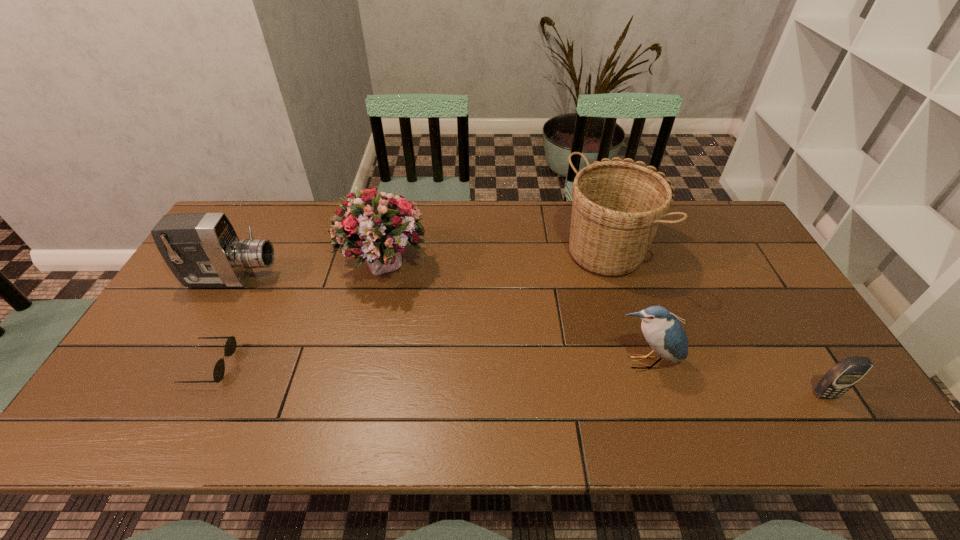
You are a GUI agent. You are given a task and a screenshot of the screen. Output one action in this format:
    pyautogui.click(x=<x>, y=<y>)
    Task: Click on the free space between the sunglasses and the basket
    The height and width of the screenshot is (540, 960).
    Given the screenshot: What is the action you would take?
    pyautogui.click(x=413, y=305)

Locate an element on the screen. Image resolution: width=960 pixels, height=540 pixels. free space that is in between the second shortest object and the sunglasses is located at coordinates (517, 380).

Point out which object is positioned as the fourth nearest to the fourth object from right to left. Please provide its 2D coordinates. Your answer should be formatted as a tuple, i.e. [(x, y)], where the tuple contains the x and y coordinates of a point satisfying the conditions above.

[(664, 333)]

Identify the location of object that is the fifth closest to the camcorder. (848, 371).

This screenshot has height=540, width=960. I want to click on vacant region that satisfies the following two spatial constraints: 1. at the tip of the bird's beak; 2. on the front-facing side of the sunglasses, so click(x=645, y=365).

Identify the location of vacant area that satisfies the following two spatial constraints: 1. on the front side of the fourth object from right to left; 2. at the front of the camcorder, highlighting the lens. The width and height of the screenshot is (960, 540). (382, 279).

At what (x,y) coordinates should I click in order to perform the action: click on vacant space that satisfies the following two spatial constraints: 1. at the tip of the bird's beak; 2. on the front-facing side of the shortest object. Please return your answer as a coordinate pair (x, y). Looking at the image, I should click on (645, 365).

This screenshot has width=960, height=540. I want to click on free location that satisfies the following two spatial constraints: 1. at the tip of the bird's beak; 2. on the front-facing side of the shortest object, so click(645, 365).